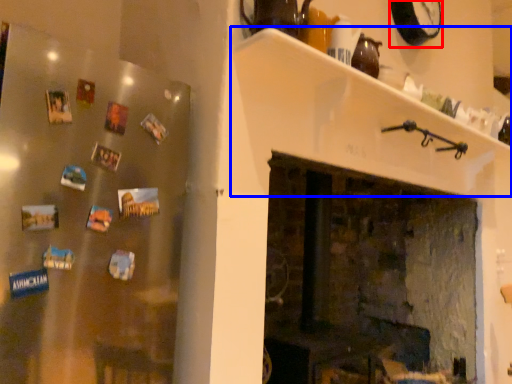
Question: Which point is closer to the camera, clock (highlighted by a red box) or shelf (highlighted by a blue box)?

Choices:
 (A) clock
 (B) shelf

Answer: (B)